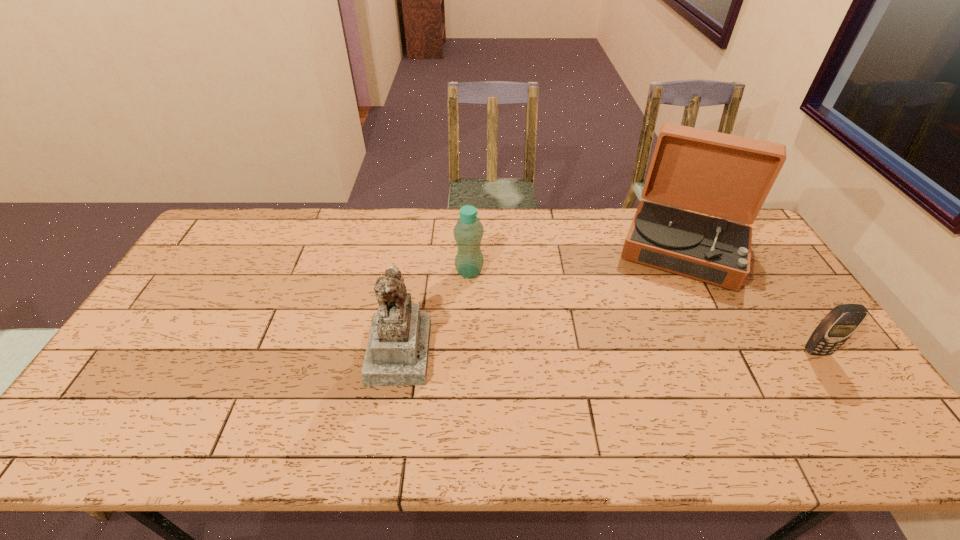
Image resolution: width=960 pixels, height=540 pixels. In order to click on free space on the desktop that is between the figurine and the shortest object and is positioned on the face of the phonograph record in this screenshot , I will do `click(659, 351)`.

Where is `free space on the desktop that is between the leftmost object and the shortest object and is positioned at the front cap of the second object from left to right`? This screenshot has width=960, height=540. free space on the desktop that is between the leftmost object and the shortest object and is positioned at the front cap of the second object from left to right is located at coordinates (563, 351).